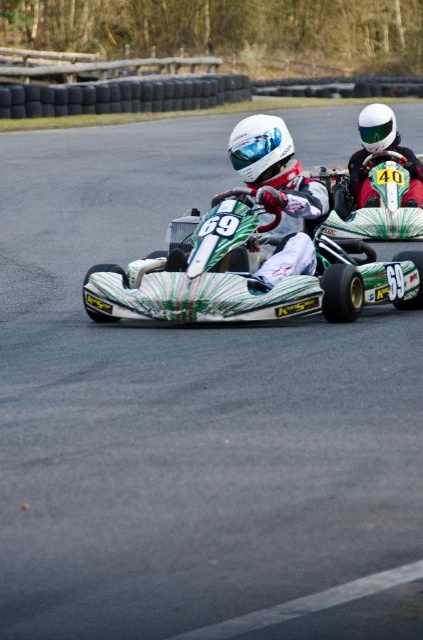
Does white glossy helmet at center have a lesser width compared to white matte helmet at upper right?

In fact, white glossy helmet at center might be wider than white matte helmet at upper right.

Can you confirm if white glossy helmet at center is positioned below white matte helmet at upper right?

Yes, white glossy helmet at center is below white matte helmet at upper right.

What are the coordinates of `white glossy helmet at center` in the screenshot? It's located at (279, 192).

Does green and white painted go-kart at center have a greater height compared to white matte helmet at upper right?

Yes, green and white painted go-kart at center is taller than white matte helmet at upper right.

The width and height of the screenshot is (423, 640). What do you see at coordinates (249, 273) in the screenshot? I see `green and white painted go-kart at center` at bounding box center [249, 273].

At what (x,y) coordinates should I click in order to perform the action: click on green and white painted go-kart at center. Please return your answer as a coordinate pair (x, y). Looking at the image, I should click on (249, 273).

Is green and white painted go-kart at center in front of white glossy helmet at center?

Yes, it is in front of white glossy helmet at center.

I want to click on green and white painted go-kart at center, so click(x=249, y=273).

Image resolution: width=423 pixels, height=640 pixels. I want to click on green and white painted go-kart at center, so click(249, 273).